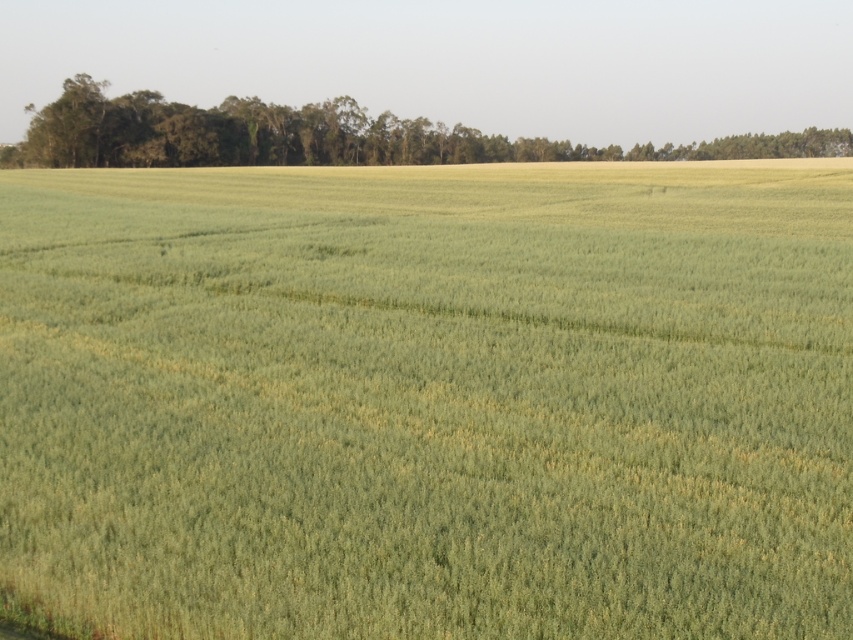
You are standing in the middle of the agricultural field and see the green grass at center and the green leafy trees at upper center. Which object is nearer to you?

The green grass at center is closer to the viewer than the green leafy trees at upper center.

You are standing in the middle of the agricultural field and see two points marked in the image. The first point is at coordinates point (93, 275) and the second is at point (785, 144). Which point is closer to you?

Point (93, 275) is in front of point (785, 144), so the first point is closer to you.